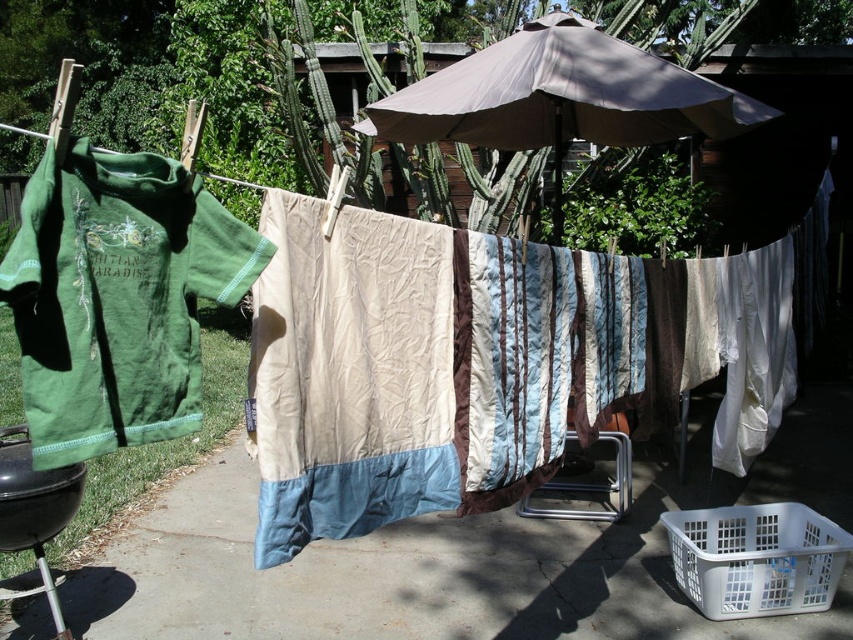
Question: Based on their relative distances, which object is nearer to the beige fabric umbrella at upper center?

Choices:
 (A) beige quilted blanket at center
 (B) smooth concrete pavement at center
 (C) white plastic basket at lower right
 (D) green cotton blanket at left

Answer: (A)

Question: Which of the following is the farthest from the observer?

Choices:
 (A) (91, 220)
 (B) (445, 632)

Answer: (B)

Question: Considering the relative positions of green cotton blanket at left and white plastic basket at lower right in the image provided, where is green cotton blanket at left located with respect to white plastic basket at lower right?

Choices:
 (A) right
 (B) left

Answer: (B)

Question: Does beige quilted blanket at center have a lesser width compared to white plastic basket at lower right?

Choices:
 (A) no
 (B) yes

Answer: (A)

Question: Can you confirm if smooth concrete pavement at center is positioned below white plastic basket at lower right?

Choices:
 (A) no
 (B) yes

Answer: (B)

Question: Estimate the real-world distances between objects in this image. Which object is closer to the beige fabric umbrella at upper center?

Choices:
 (A) smooth concrete pavement at center
 (B) green cotton blanket at left
 (C) beige quilted blanket at center

Answer: (C)